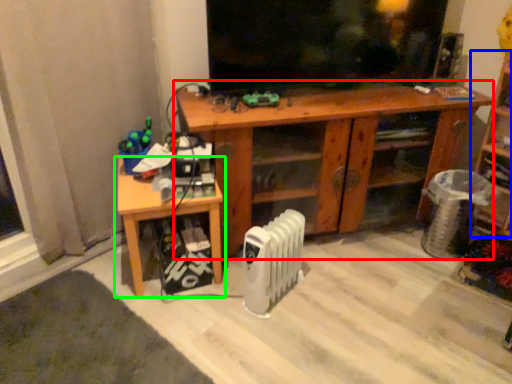
Question: Which object is the closest to the desk (highlighted by a red box)? Choose among these: shelf (highlighted by a blue box) or table (highlighted by a green box).

Choices:
 (A) shelf
 (B) table

Answer: (B)